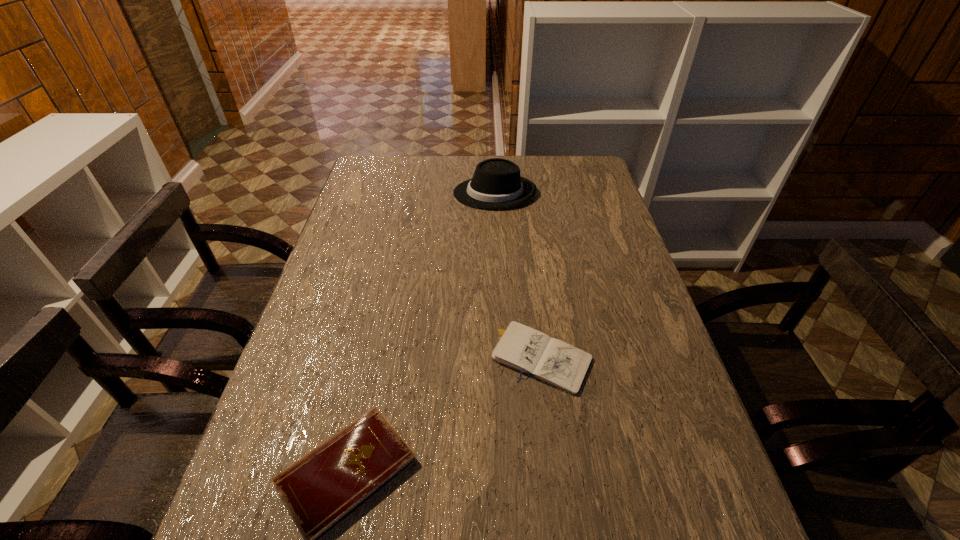
Where is `vacant space at the left edge`? Image resolution: width=960 pixels, height=540 pixels. vacant space at the left edge is located at coordinates point(301,384).

The height and width of the screenshot is (540, 960). I want to click on free region at the right edge of the desktop, so click(x=574, y=201).

The image size is (960, 540). I want to click on vacant space at the far left corner, so click(x=395, y=156).

This screenshot has height=540, width=960. Find the location of `free point between the tallest object and the right notebook`. free point between the tallest object and the right notebook is located at coordinates (518, 275).

You are a GUI agent. You are given a task and a screenshot of the screen. Output one action in this format:
    pyautogui.click(x=<x>, y=<y>)
    Task: Click on the free space between the tallest object and the second farthest object
    The image size is (960, 540).
    Given the screenshot: What is the action you would take?
    pyautogui.click(x=518, y=275)

In order to click on free space that is in between the fedora and the right notebook in this screenshot , I will do `click(518, 275)`.

You are a GUI agent. You are given a task and a screenshot of the screen. Output one action in this format:
    pyautogui.click(x=<x>, y=<y>)
    Task: Click on the free area in between the farthest object and the right notebook
    The height and width of the screenshot is (540, 960).
    Given the screenshot: What is the action you would take?
    pyautogui.click(x=518, y=275)

Find the location of a particular element. Image resolution: width=960 pixels, height=540 pixels. vacant point located between the farthest object and the second farthest object is located at coordinates (518, 275).

Where is `object that can be found as the second closest to the tallest object`? object that can be found as the second closest to the tallest object is located at coordinates (322, 489).

The image size is (960, 540). Find the location of `the closest object to the nearest object`. the closest object to the nearest object is located at coordinates (521, 348).